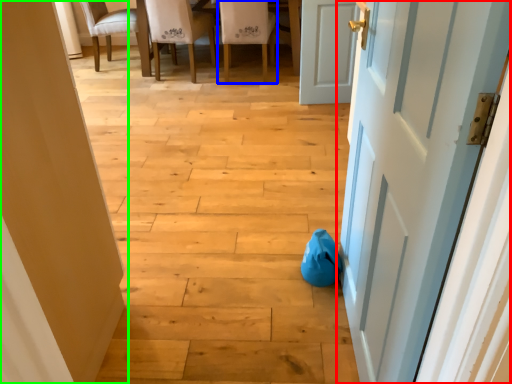
Question: Considering the real-world distances, which object is farthest from door (highlighted by a red box)? chair (highlighted by a blue box) or door (highlighted by a green box)?

Choices:
 (A) chair
 (B) door

Answer: (A)